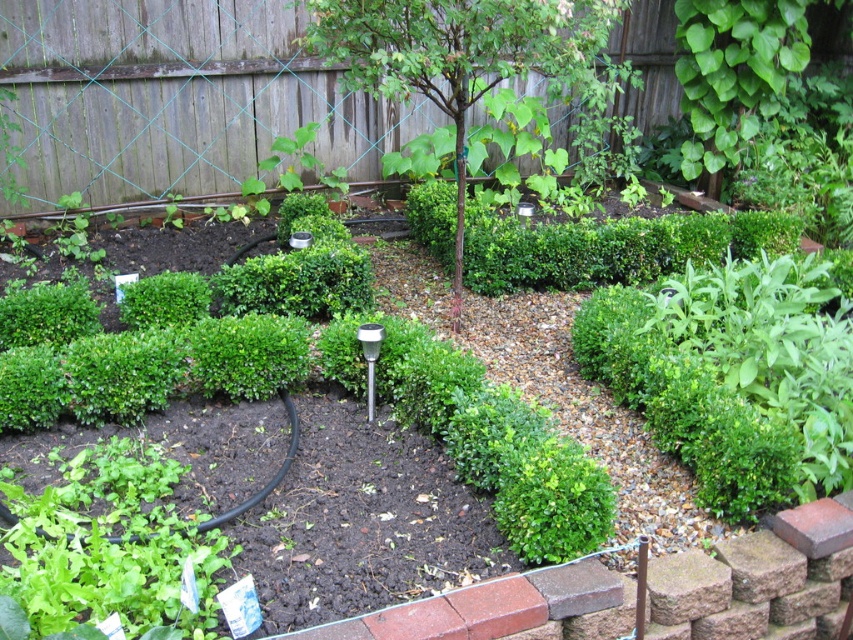
Is point (660, 17) farther from viewer compared to point (384, 81)?

That is True.

Between point (167, 29) and point (550, 3), which one is positioned in front?

Positioned in front is point (550, 3).

Is point (827, 17) positioned behind point (303, 40)?

Yes, point (827, 17) is behind point (303, 40).

Find the location of a particular element. wooden fence at upper center is located at coordinates point(173,97).